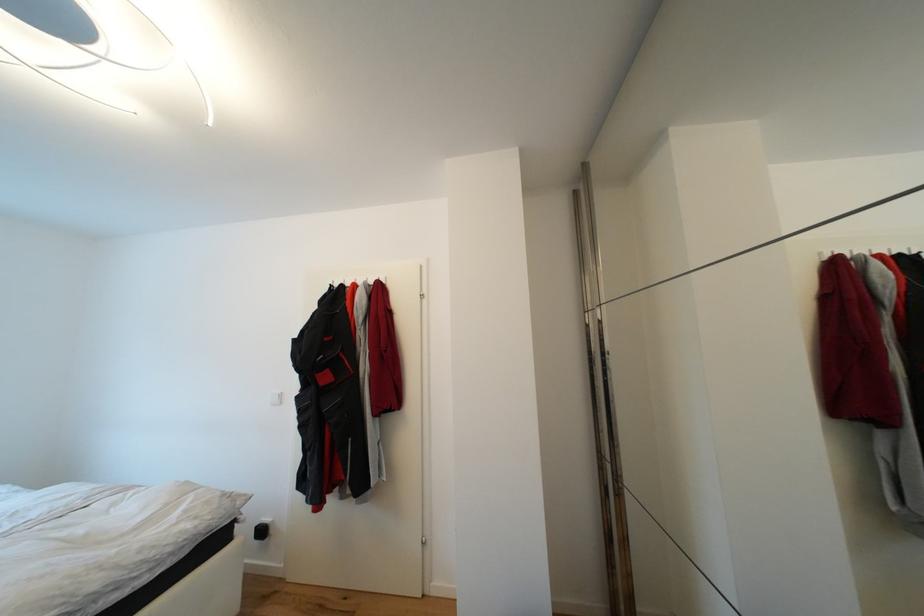
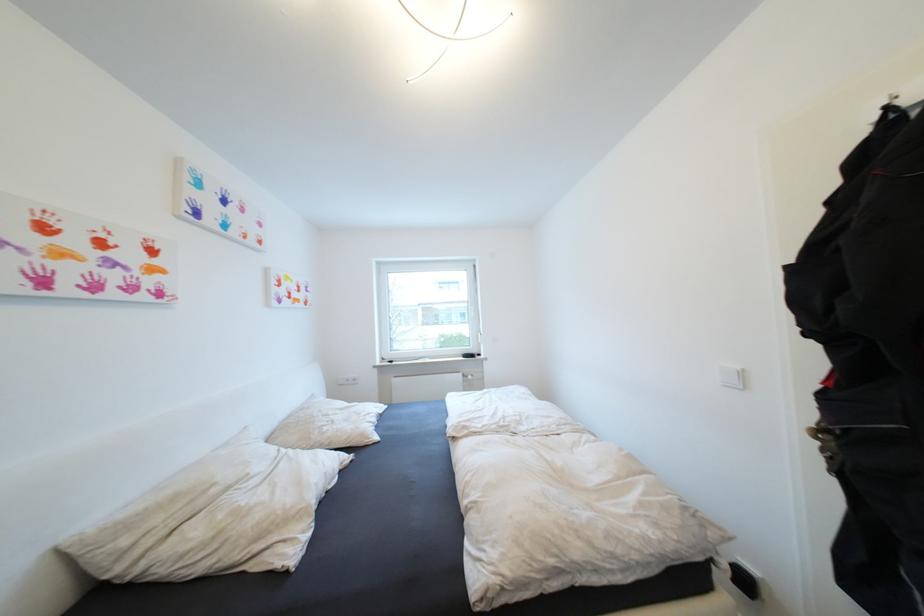
Question: The camera is either moving clockwise (left) or counter-clockwise (right) around the object. The first image is from the beginning of the video and the second image is from the end. Is the camera moving left or right when shooting the video?

Choices:
 (A) Left
 (B) Right

Answer: (B)